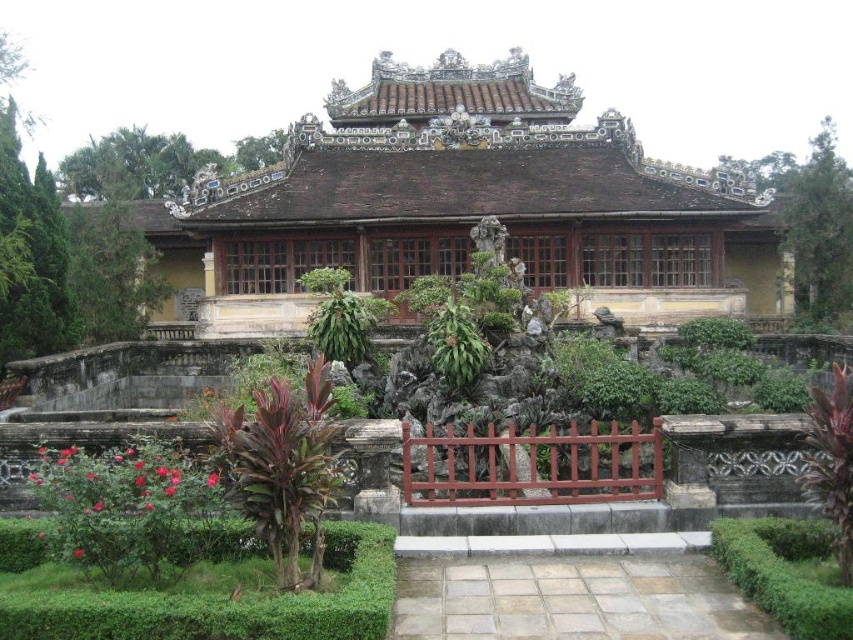
Consider the image. Does yellowish-green stone palace at center have a lesser width compared to green leafy bush at lower right?

In fact, yellowish-green stone palace at center might be wider than green leafy bush at lower right.

Between yellowish-green stone palace at center and green leafy bush at lower right, which one is positioned lower?

green leafy bush at lower right

You are a GUI agent. You are given a task and a screenshot of the screen. Output one action in this format:
    pyautogui.click(x=<x>, y=<y>)
    Task: Click on the yellowish-green stone palace at center
    This screenshot has width=853, height=640.
    Given the screenshot: What is the action you would take?
    pyautogui.click(x=465, y=208)

Does yellowish-green stone palace at center have a lesser width compared to red matte rose bush at lower left?

In fact, yellowish-green stone palace at center might be wider than red matte rose bush at lower left.

How far apart are yellowish-green stone palace at center and red matte rose bush at lower left?

yellowish-green stone palace at center and red matte rose bush at lower left are 35.05 meters apart.

Is point (500, 195) positioned in front of point (94, 528)?

No.

Locate an element on the screen. This screenshot has width=853, height=640. yellowish-green stone palace at center is located at coordinates (465, 208).

Is red matte rose bush at lower left below green leafy plant at center?

Correct, red matte rose bush at lower left is located below green leafy plant at center.

Between point (91, 548) and point (463, 369), which one is positioned in front?

Point (91, 548) is in front.

Identify the location of red matte rose bush at lower left. (131, 508).